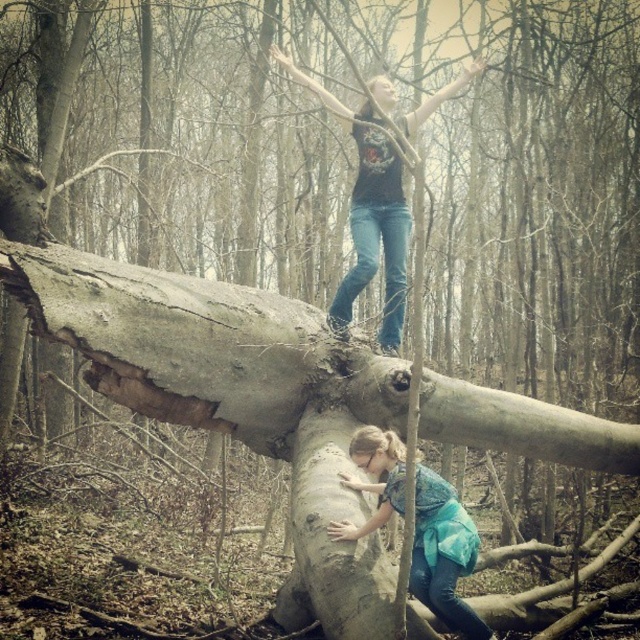
Does matte black shirt at upper center lie in front of blue denim jeans at lower center?

No, it is behind blue denim jeans at lower center.

Where is `matte black shirt at upper center`? The height and width of the screenshot is (640, 640). matte black shirt at upper center is located at coordinates (369, 216).

Identify the location of matte black shirt at upper center. This screenshot has width=640, height=640. click(369, 216).

Is point (307, 467) farther from viewer compared to point (451, 499)?

Yes, it is behind point (451, 499).

Is smooth gray log at lower center thinner than blue denim jeans at lower center?

Indeed, smooth gray log at lower center has a lesser width compared to blue denim jeans at lower center.

Describe the element at coordinates (332, 541) in the screenshot. The image size is (640, 640). I see `smooth gray log at lower center` at that location.

At what (x,y) coordinates should I click in order to perform the action: click on smooth gray log at lower center. Please return your answer as a coordinate pair (x, y). This screenshot has width=640, height=640. Looking at the image, I should click on (332, 541).

Who is higher up, smooth gray log at lower center or matte black shirt at upper center?

matte black shirt at upper center is higher up.

How far apart are smooth gray log at lower center and matte black shirt at upper center?

The distance of smooth gray log at lower center from matte black shirt at upper center is 4.48 feet.

Where is `smooth gray log at lower center`? smooth gray log at lower center is located at coordinates (332, 541).

The image size is (640, 640). Find the location of `smooth gray log at lower center`. smooth gray log at lower center is located at coordinates (332, 541).